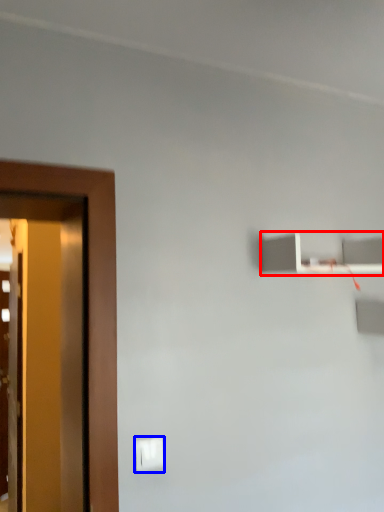
Question: Among these objects, which one is farthest to the camera, shelf (highlighted by a red box) or light switch (highlighted by a blue box)?

Choices:
 (A) shelf
 (B) light switch

Answer: (A)